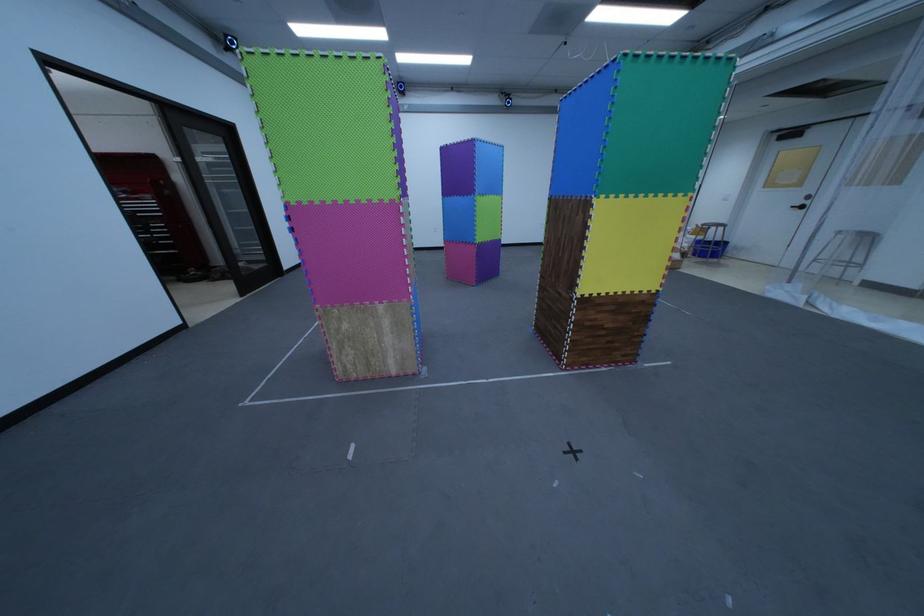
Where is `stool sitting surface`? stool sitting surface is located at coordinates (857, 233).